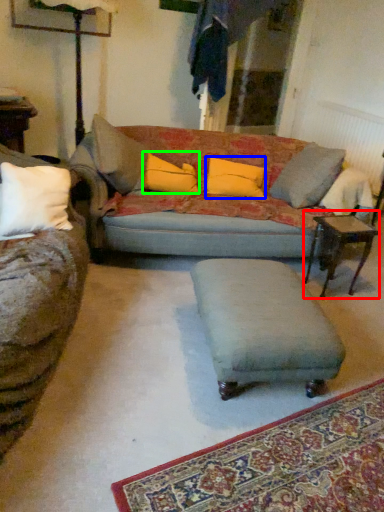
Question: Which is nearer to the table (highlighted by a red box)? pillow (highlighted by a blue box) or pillow (highlighted by a green box).

Choices:
 (A) pillow
 (B) pillow

Answer: (A)